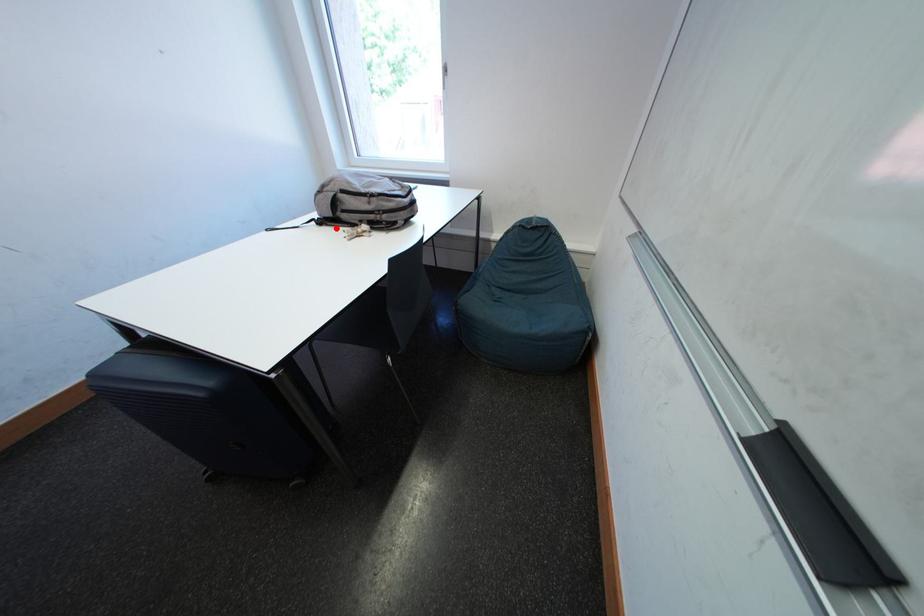
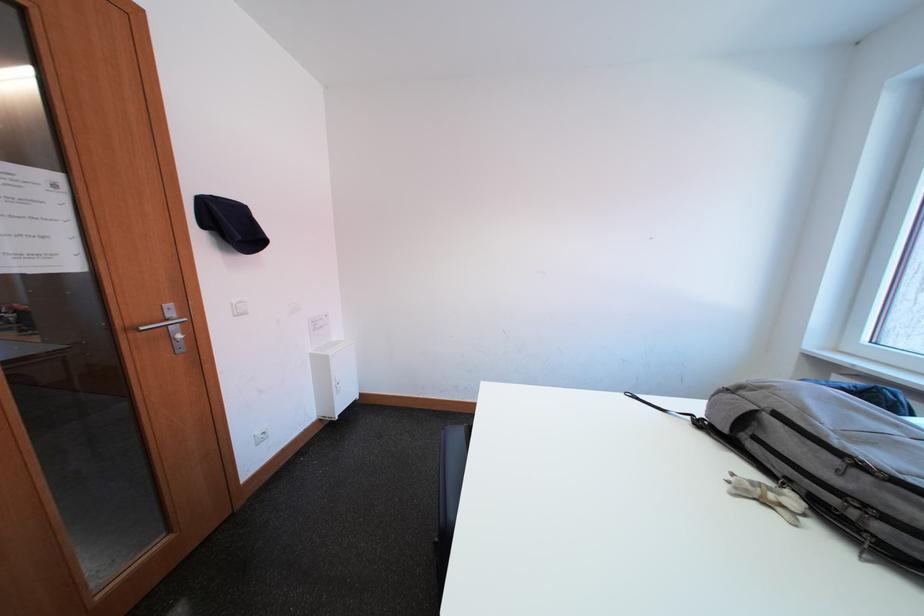
Locate, in the second image, the point that corresponds to the highlighted location in the first image.

(719, 438)